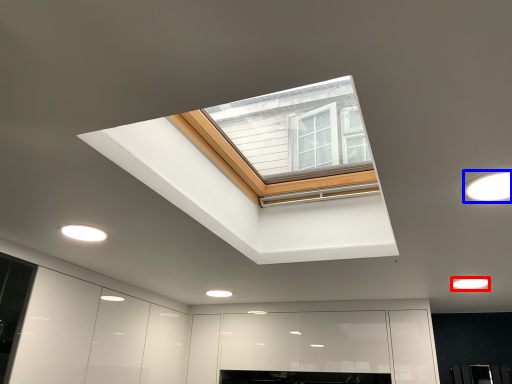
Question: Which object appears farthest to the camera in this image, lighting (highlighted by a red box) or lighting (highlighted by a blue box)?

Choices:
 (A) lighting
 (B) lighting

Answer: (A)